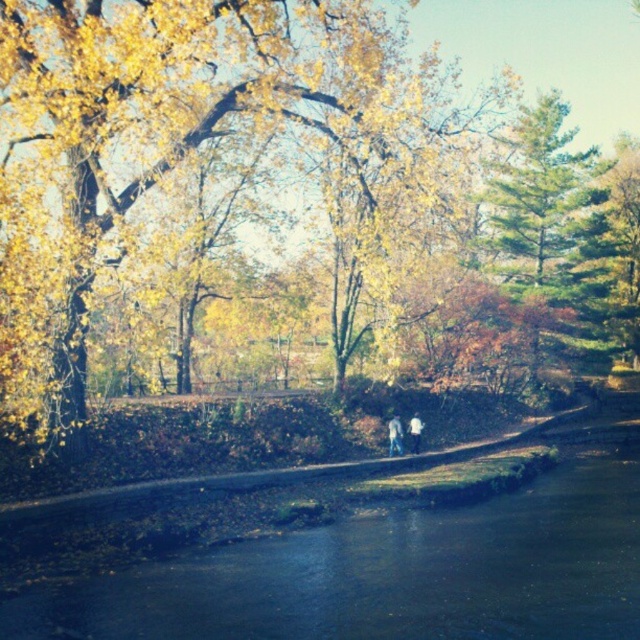
Question: Among these points, which one is nearest to the camera?

Choices:
 (A) (400, 420)
 (B) (397, 436)
 (C) (417, 452)
 (D) (636, 602)

Answer: (D)

Question: Among these points, which one is nearest to the camera?

Choices:
 (A) (390, 429)
 (B) (332, 566)
 (C) (419, 445)
 (D) (390, 419)

Answer: (B)

Question: From the image, what is the correct spatial relationship of blue jeans at center in relation to white matte shirt at center?

Choices:
 (A) left
 (B) right

Answer: (A)

Question: Estimate the real-world distances between objects in this image. Which object is closer to the dark blue water at center?

Choices:
 (A) light blue jeans at center
 (B) white matte shirt at center
 (C) blue jeans at center

Answer: (C)

Question: Is light blue jeans at center bigger than white matte shirt at center?

Choices:
 (A) no
 (B) yes

Answer: (B)

Question: Is dark blue water at center to the right of blue jeans at center from the viewer's perspective?

Choices:
 (A) yes
 (B) no

Answer: (A)